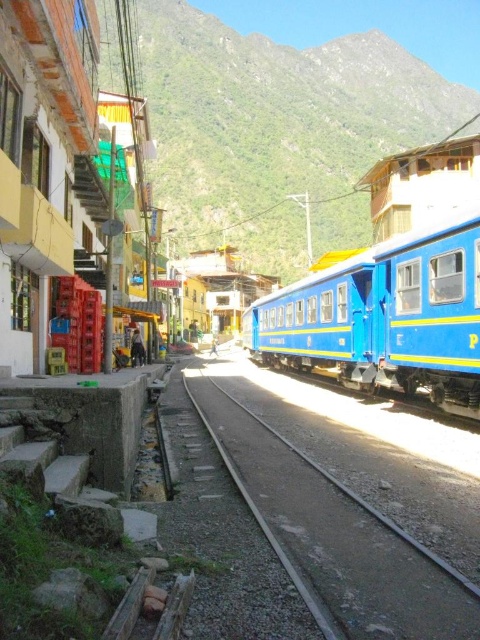
Question: Is green leafy mountain at upper center thinner than gray gravel track at center?

Choices:
 (A) no
 (B) yes

Answer: (A)

Question: Which object is the closest to the green leafy mountain at upper center?

Choices:
 (A) blue matte train at right
 (B) gray gravel track at center

Answer: (A)

Question: Does green leafy mountain at upper center have a larger size compared to blue matte train at right?

Choices:
 (A) no
 (B) yes

Answer: (B)

Question: Does green leafy mountain at upper center lie in front of gray gravel track at center?

Choices:
 (A) yes
 (B) no

Answer: (B)

Question: Which point is farther to the camera?

Choices:
 (A) blue matte train at right
 (B) gray gravel track at center
 (C) green leafy mountain at upper center

Answer: (C)

Question: Which point is farther from the camera taking this photo?

Choices:
 (A) (357, 76)
 (B) (203, 388)
 (C) (301, 353)

Answer: (A)